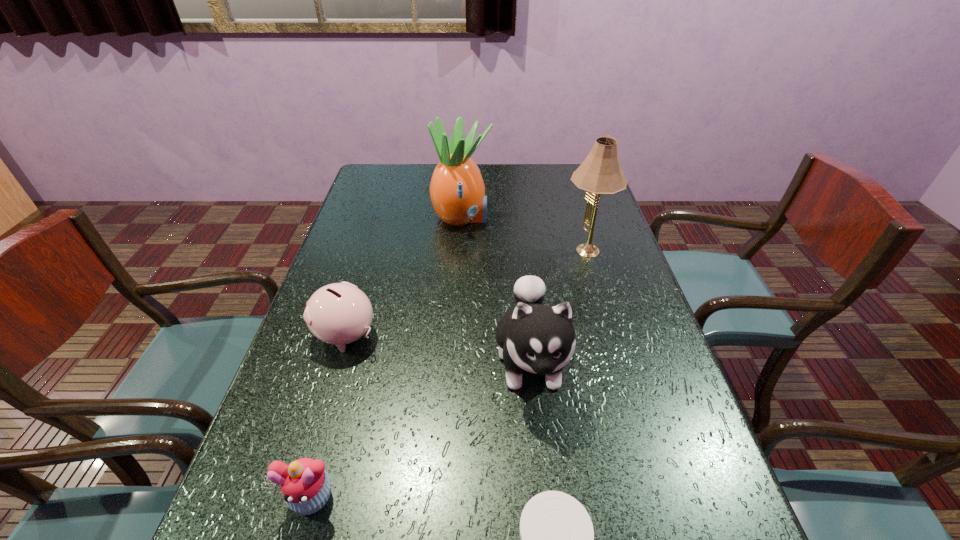
This screenshot has width=960, height=540. What are the coordinates of `unoccupied position between the piggy bank and the puppy` in the screenshot? It's located at (438, 347).

Identify the location of the fourth closest object to the Dixie cup. This screenshot has height=540, width=960. (600, 173).

Where is `object that is the second closest one to the third tallest object`? object that is the second closest one to the third tallest object is located at coordinates pos(557,538).

Find the location of a particular element. The height and width of the screenshot is (540, 960). vacant area that satisfies the following two spatial constraints: 1. at the entrance of the fifth shortest object; 2. on the back side of the rightmost object is located at coordinates (460, 253).